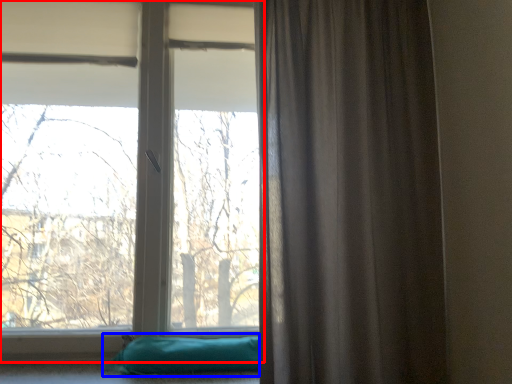
Question: Which of the following is the closest to the observer, window (highlighted by a red box) or pillow (highlighted by a blue box)?

Choices:
 (A) window
 (B) pillow

Answer: (B)